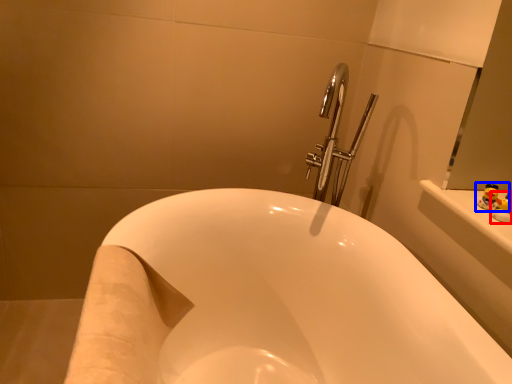
Question: Which of the following is the farthest to the observer, toy (highlighted by a red box) or toy (highlighted by a blue box)?

Choices:
 (A) toy
 (B) toy

Answer: (B)